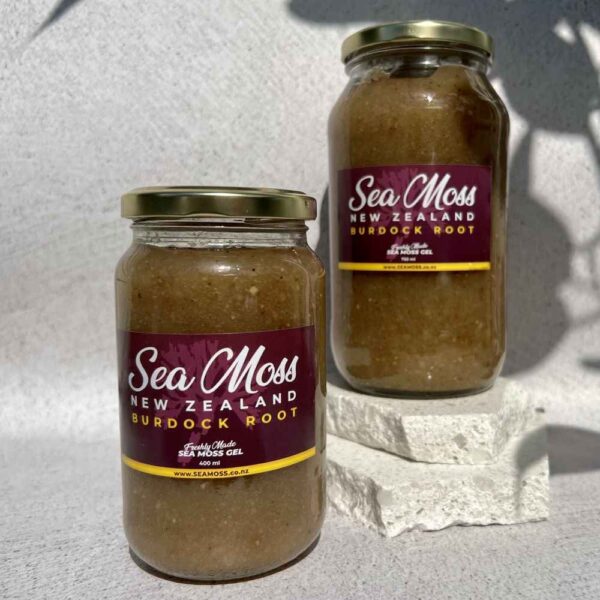
Image resolution: width=600 pixels, height=600 pixels. Identify the location of wall. (188, 102).